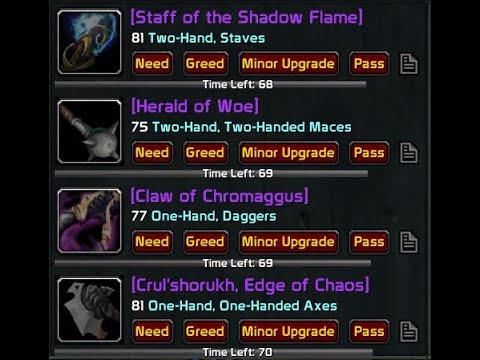
Where is `brackets`? The image size is (480, 360). brackets is located at coordinates (256, 106).